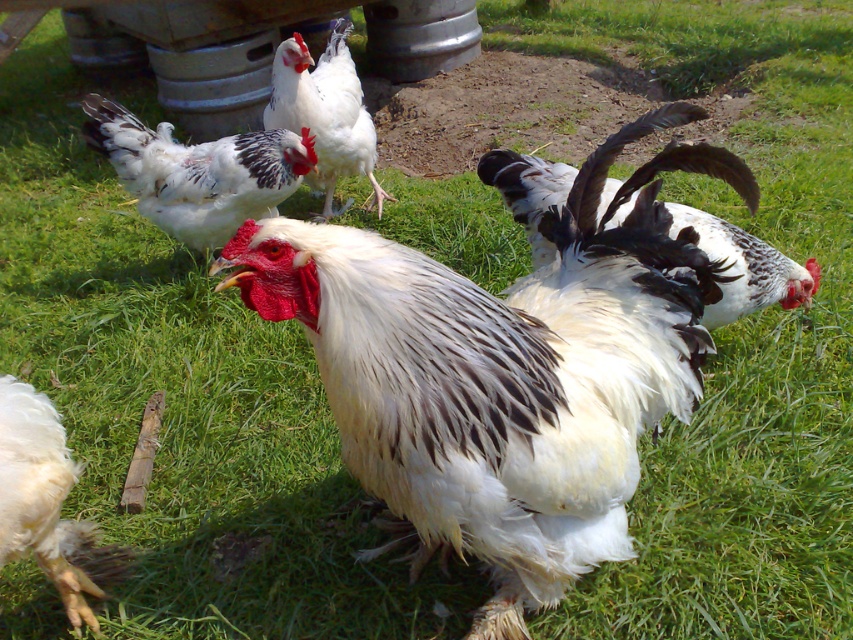
The height and width of the screenshot is (640, 853). What do you see at coordinates (198, 172) in the screenshot?
I see `white fluffy chicken at center` at bounding box center [198, 172].

From the picture: Can you confirm if white fluffy chicken at center is shorter than white glossy rooster at center?

In fact, white fluffy chicken at center may be taller than white glossy rooster at center.

Is point (184, 173) behind point (611, 218)?

Yes, it is behind point (611, 218).

Locate an element on the screen. This screenshot has height=640, width=853. white fluffy chicken at center is located at coordinates (198, 172).

Is white fluffy chicken at center above white fluffy chicken at upper center?

Actually, white fluffy chicken at center is below white fluffy chicken at upper center.

Is point (115, 104) positioned before point (279, 67)?

That is False.

The width and height of the screenshot is (853, 640). What are the coordinates of `white fluffy chicken at center` in the screenshot? It's located at coord(198,172).

Can you confirm if white fluffy chicken at center is taller than white fluffy feather at lower left?

No, white fluffy chicken at center is not taller than white fluffy feather at lower left.

Between white fluffy chicken at center and white fluffy feather at lower left, which one appears on the left side from the viewer's perspective?

white fluffy chicken at center is more to the left.

This screenshot has width=853, height=640. I want to click on white fluffy chicken at center, so click(x=198, y=172).

Where is `white fluffy chicken at center`? white fluffy chicken at center is located at coordinates (198, 172).